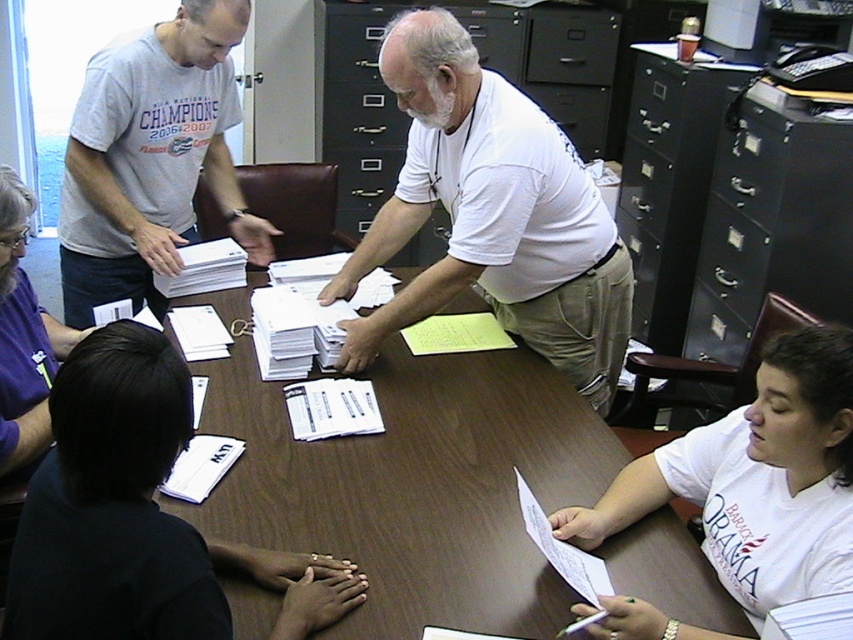
From the picture: You are a delivery person who needs to place a small package between the white matte shirt at center and the black matte shirt at lower left. Can you fit the package there if it requires at least 1 meter of space?

The distance between the white matte shirt at center and the black matte shirt at lower left is 1.08 meters, which is more than the required 1 meter. Therefore, the package can be placed there comfortably.